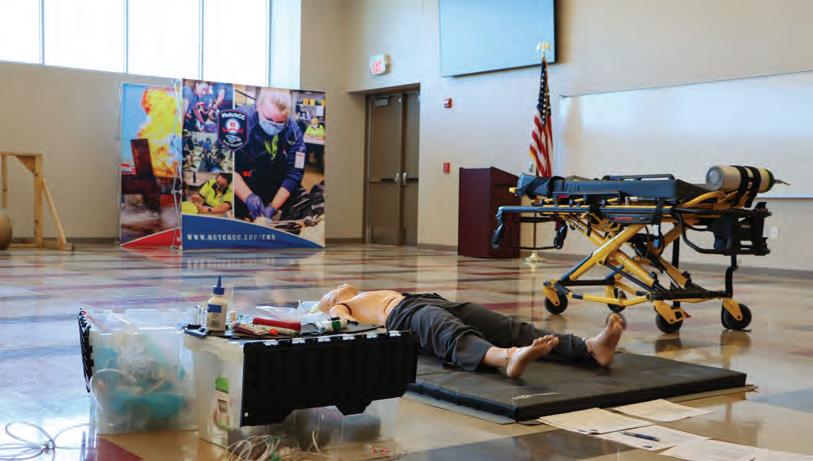
Where is `tile`? This screenshot has width=813, height=461. tile is located at coordinates (728, 431).